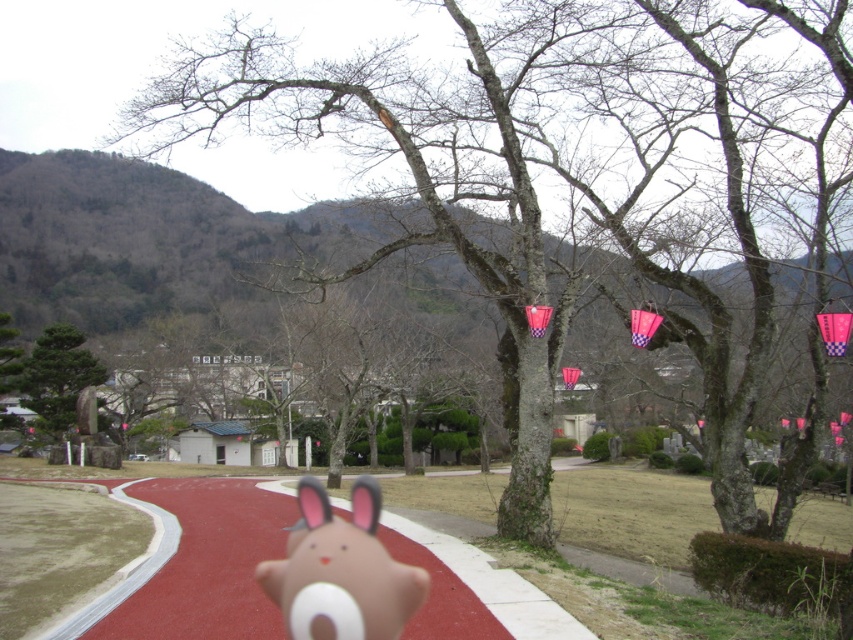
Question: Which point appears closest to the camera in this image?

Choices:
 (A) (86, 369)
 (B) (225, 627)

Answer: (B)

Question: Among these objects, which one is nearest to the camera?

Choices:
 (A) red rubber path at center
 (B) green matte stone at left

Answer: (A)

Question: Does red rubber path at center appear on the right side of white matte plush toy at center?

Choices:
 (A) no
 (B) yes

Answer: (A)

Question: Which point is farther to the camera?

Choices:
 (A) white matte plush toy at center
 (B) green matte stone at left
 (C) red rubber path at center

Answer: (B)

Question: Is red rubber path at center thinner than green matte stone at left?

Choices:
 (A) no
 (B) yes

Answer: (A)

Question: Considering the relative positions of red rubber path at center and green matte stone at left in the image provided, where is red rubber path at center located with respect to green matte stone at left?

Choices:
 (A) below
 (B) above

Answer: (A)